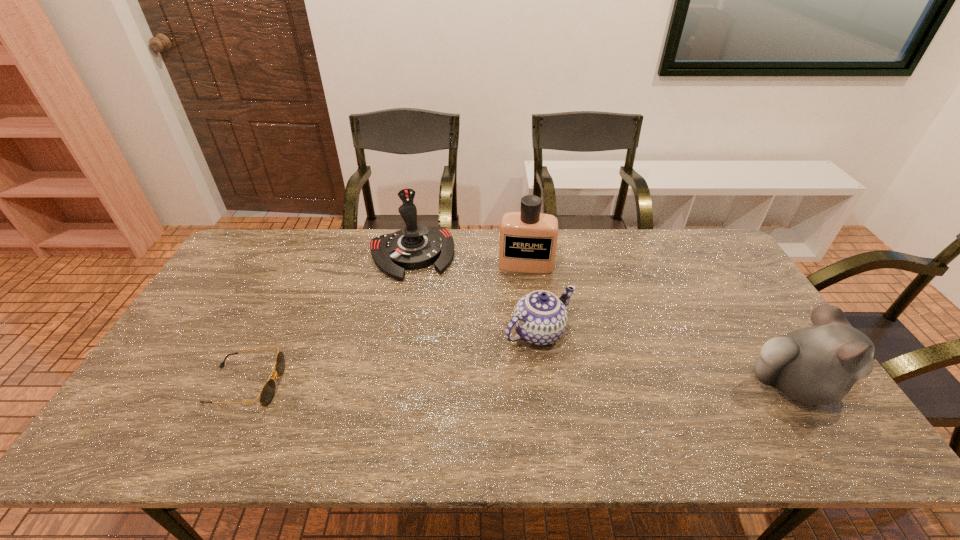
Identify the location of sunglasses. This screenshot has height=540, width=960. (267, 393).

This screenshot has width=960, height=540. Identify the location of the shortest object. click(267, 393).

Locate an element on the screen. hamster is located at coordinates point(818,365).

Identify the location of perfume. The image size is (960, 540). (528, 239).

Where is `the second shortest object`? The height and width of the screenshot is (540, 960). the second shortest object is located at coordinates (540, 317).

Find the location of `chinaware`. chinaware is located at coordinates (540, 317).

Identify the location of joystick. This screenshot has height=540, width=960. (416, 246).

Find the location of a particular element. This screenshot has width=960, height=540. vacant space located on the front-facing side of the sunglasses is located at coordinates (336, 386).

Where is `free region located on the front label of the perfume`? This screenshot has height=540, width=960. free region located on the front label of the perfume is located at coordinates (520, 347).

Identify the location of vacant space situated 0.200m on the front label of the perfume. (522, 318).